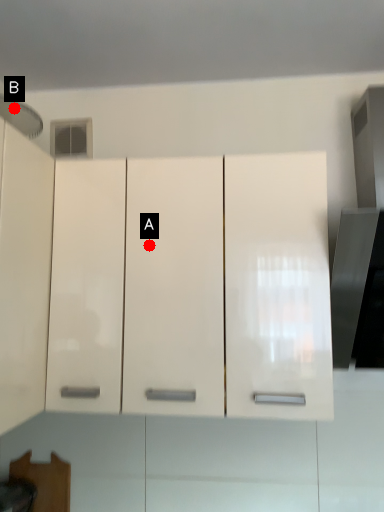
Question: Two points are circled on the image, labeled by A and B beside each circle. Which point is closer to the camera?

Choices:
 (A) A is closer
 (B) B is closer

Answer: (A)